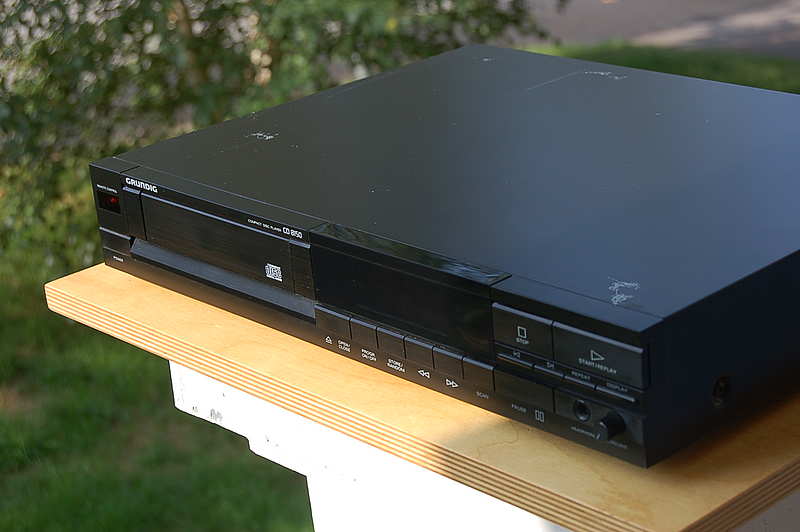
The height and width of the screenshot is (532, 800). In order to click on brown wood table surface in this screenshot , I will do `click(174, 319)`, `click(336, 390)`.